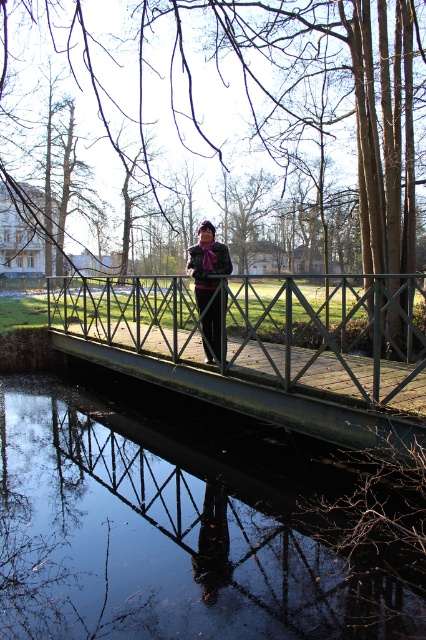
You are a delivery drone that needs to pass through the area where the green metal pedestrian bridge at center and the plaid wool coat at center are located. The drone has a wingspan of 1 meter. Can you safely navigate between these two objects without hitting either?

The green metal pedestrian bridge at center might be wider than the plaid wool coat at center. Since the bridge is wider, there should be sufficient space for the drone to navigate safely between them, provided the drone stays within the bridge structure. However, the exact width difference isn

You are standing on the wooden bridge and want to take a photo of the glossy water at bridge center. Where should you point your camera to capture it?

You should point your camera towards the center of the bridge where the glossy water is located at point coordinates (x=169, y=528).

You are a photographer planning to take a picture of the plaid wool coat at center and the glossy water at bridge center. Which object should you focus on first if you want to capture both in a single shot without adjusting the camera focus?

The plaid wool coat at center should be focused on first because it is closer to the camera than the glossy water at bridge center, which is farther away.